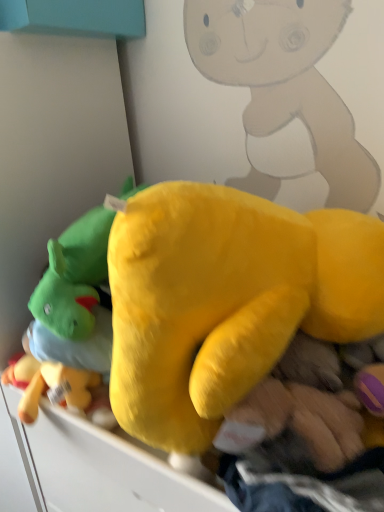
What is the approximate width of soft yellow plush at center?

soft yellow plush at center is 22.59 inches wide.

You are a GUI agent. You are given a task and a screenshot of the screen. Output one action in this format:
    pyautogui.click(x=<x>, y=<y>)
    Task: Click on the soft yellow plush at center
    The image size is (384, 512).
    Given the screenshot: What is the action you would take?
    pyautogui.click(x=218, y=303)

Describe the element at coordinates (218, 303) in the screenshot. I see `soft yellow plush at center` at that location.

At what (x,y) coordinates should I click in order to perform the action: click on soft yellow plush at center. Please return your answer as a coordinate pair (x, y). The height and width of the screenshot is (512, 384). Looking at the image, I should click on (218, 303).